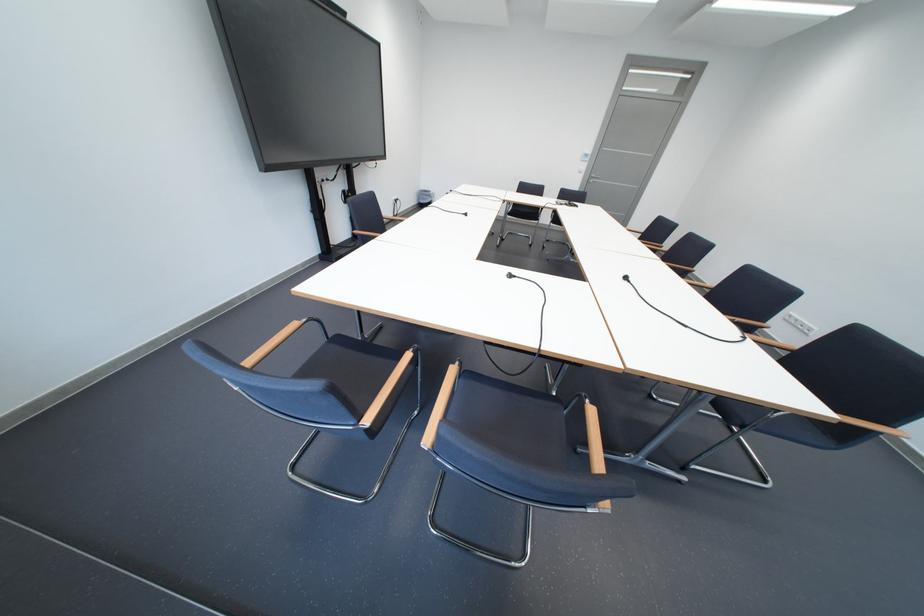
What do you see at coordinates (591, 177) in the screenshot? I see `the grey door handle` at bounding box center [591, 177].